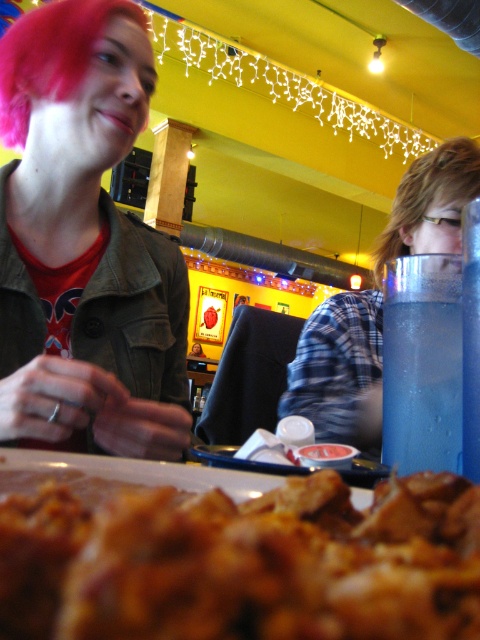
You are a food critic taking a photo of the brown crispy pastry at center for your review. Your camera has a minimum focus distance of 5 inches. Will the pastry be in focus?

The brown crispy pastry at center is only 4.62 inches away from the camera, which is less than the minimum focus distance of 5 inches. Therefore, the pastry will not be in focus.

You are a customer at the restaurant and want to grab the matte black jacket at upper left from where you are sitting. Is the brown crispy pastry at center blocking your path?

The brown crispy pastry at center is closer to the viewer than matte black jacket at upper left, so the pastry is in the way of reaching the matte black jacket at upper left.